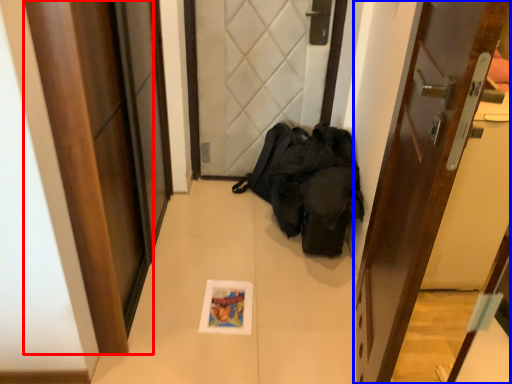
Question: Among these objects, which one is nearest to the camera, door (highlighted by a red box) or door (highlighted by a blue box)?

Choices:
 (A) door
 (B) door

Answer: (B)